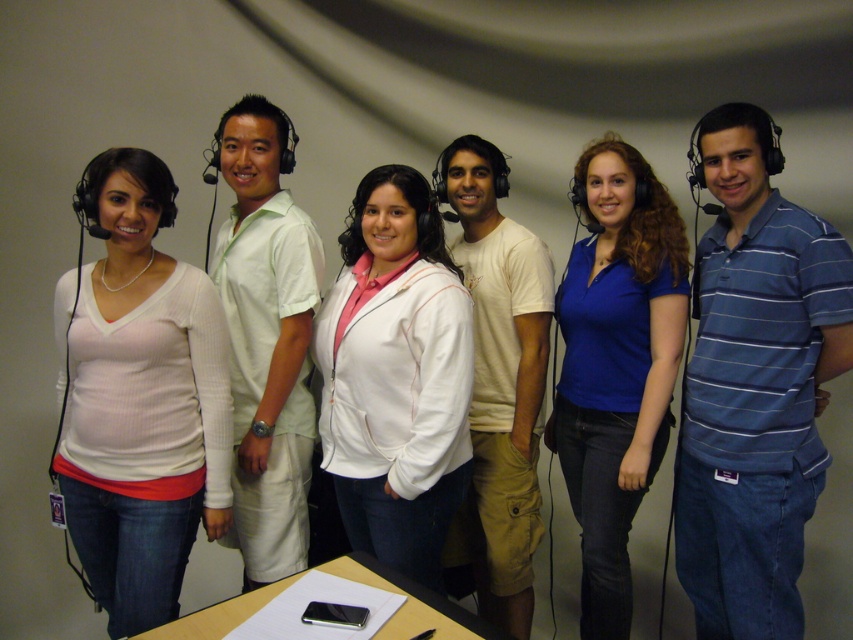
You are a photographer setting up for a group photo. You notice the white ribbed sweater at left and the black matte microphone at upper center. Which object is positioned higher in the image?

The black matte microphone at upper center is positioned higher than the white ribbed sweater at left.

You are a photographer standing in front of the group and want to take a photo focusing on the light green shirt at center and the smooth wooden table at center. Which object is closer to you?

The light green shirt at center is closer to you because it is positioned further to the viewer than the smooth wooden table at center.